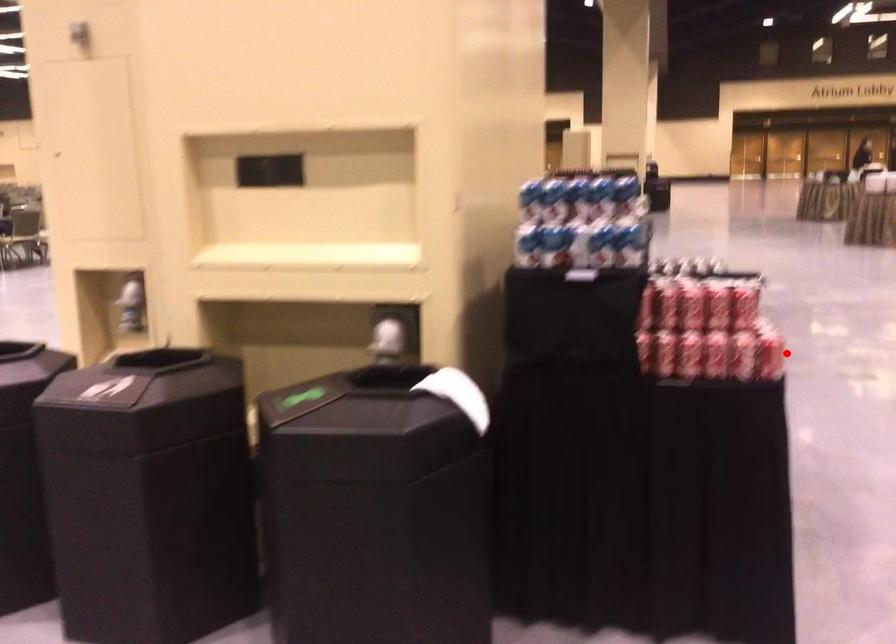
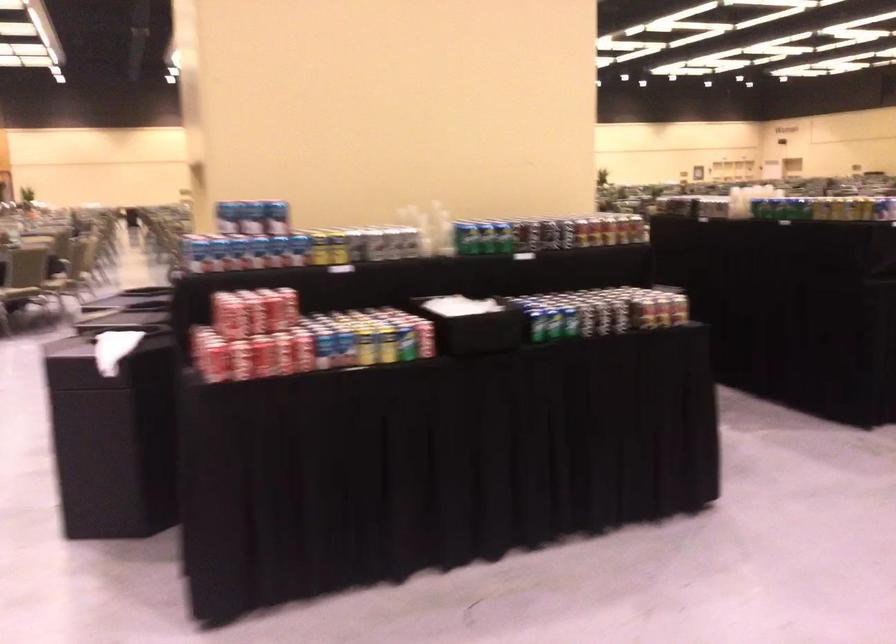
Where in the second image is the point corresponding to the highlighted location from the first image?

(211, 361)